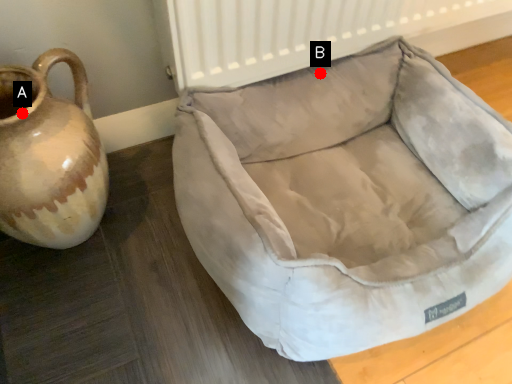
Question: Two points are circled on the image, labeled by A and B beside each circle. Which point is farther from the camera taking this photo?

Choices:
 (A) A is further
 (B) B is further

Answer: (B)